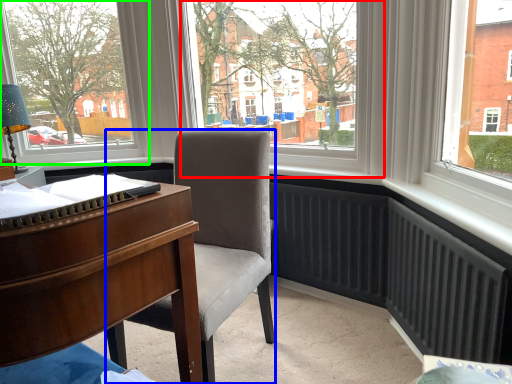
Question: Based on their relative distances, which object is farther from window screen (highlighted by a red box)? Choose from chair (highlighted by a blue box) and window (highlighted by a green box).

Choices:
 (A) chair
 (B) window

Answer: (B)